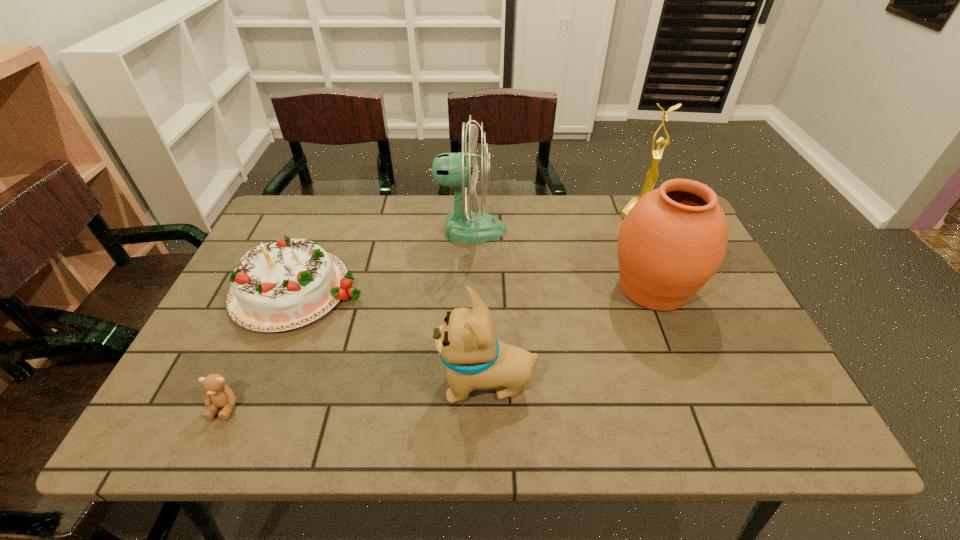
Where is `urn positioned at the right edge`? Image resolution: width=960 pixels, height=540 pixels. urn positioned at the right edge is located at coordinates (673, 240).

The image size is (960, 540). What are the coordinates of `object that is at the near left corner` in the screenshot? It's located at (219, 395).

The height and width of the screenshot is (540, 960). Identify the location of object located at the far right corner. (652, 175).

In the image, there is a desktop. Identify the location of vacant area at the far edge. The image size is (960, 540). (588, 235).

In the image, there is a desktop. Where is `vacant space at the near edge`? vacant space at the near edge is located at coordinates (461, 417).

Locate an element on the screen. This screenshot has width=960, height=540. free region at the left edge is located at coordinates (176, 389).

Identify the location of vacant region at the right edge of the desktop. (743, 358).

You are a GUI agent. You are given a task and a screenshot of the screen. Output one action in this format:
    pyautogui.click(x=<x>, y=<y>)
    Task: Click on the free space at the far left corner
    
    Given the screenshot: What is the action you would take?
    pyautogui.click(x=306, y=227)

You are a GUI agent. You are given a task and a screenshot of the screen. Output one action in this format:
    pyautogui.click(x=<x>, y=<y>)
    Task: Click on the free space that is in between the award and the cake
    The width and height of the screenshot is (960, 540).
    Given the screenshot: What is the action you would take?
    pyautogui.click(x=469, y=251)

What are the coordinates of `free space between the award and the puppy` in the screenshot? It's located at (564, 298).